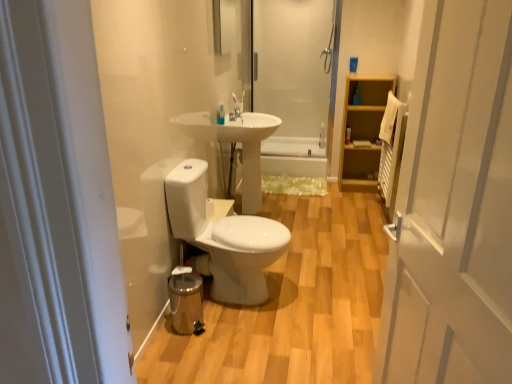
I want to click on empty space that is in between white glossy toilet at center and light wood cabinet at right, so click(325, 224).